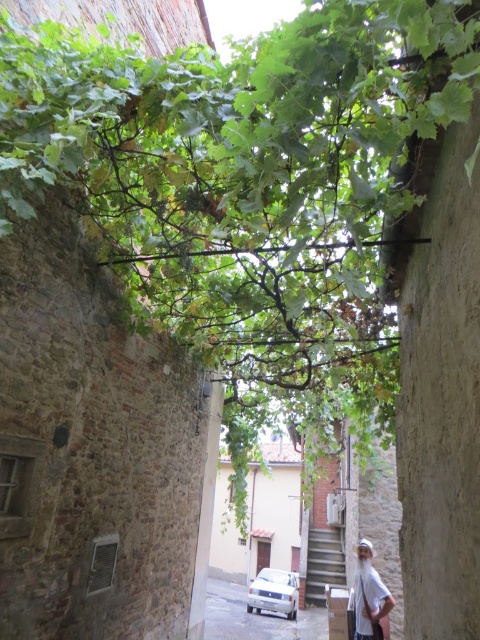
Between white matte car at lower center and white matte car at center, which one is positioned lower?

white matte car at lower center is below.

Is point (216, 600) closer to viewer compared to point (276, 589)?

No, (216, 600) is behind (276, 589).

Does point (291, 627) lie behind point (284, 580)?

No.

This screenshot has height=640, width=480. I want to click on white matte car at lower center, so click(x=240, y=616).

Does white matte car at lower center have a greater height compared to dark gray concrete stairs at center?

Indeed, white matte car at lower center has a greater height compared to dark gray concrete stairs at center.

In the scene shown: Which is below, white matte car at lower center or dark gray concrete stairs at center?

white matte car at lower center is below.

At what (x,y) coordinates should I click in order to perform the action: click on white matte car at lower center. Please return your answer as a coordinate pair (x, y). Looking at the image, I should click on (240, 616).

Where is `white matte car at lower center`? The image size is (480, 640). white matte car at lower center is located at coordinates (240, 616).

How distant is dark gray concrete stairs at center from white matte car at center?

They are 1.24 meters apart.

Is point (337, 545) farther from camera compared to point (279, 576)?

No, it is in front of (279, 576).

The image size is (480, 640). I want to click on dark gray concrete stairs at center, so click(324, 563).